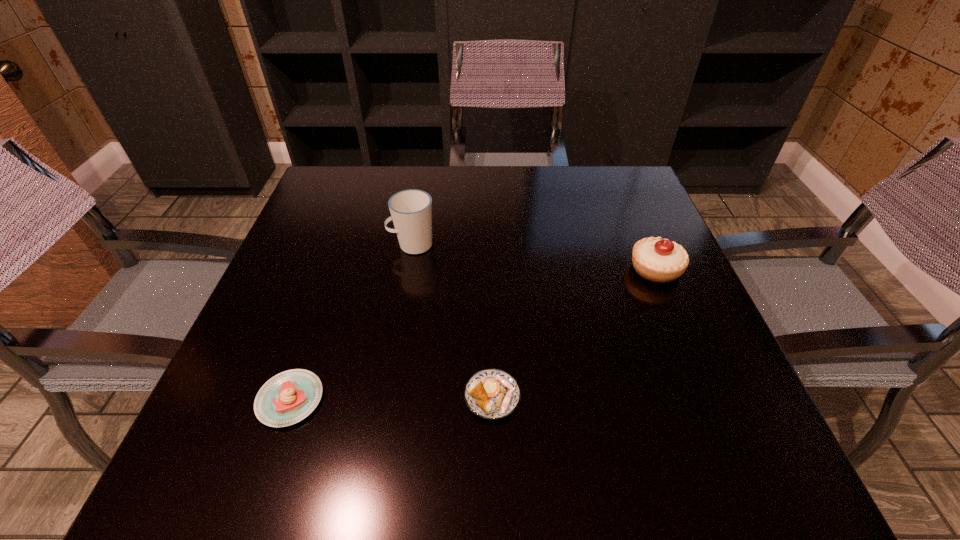
This screenshot has height=540, width=960. I want to click on object that can be found as the closest to the rightmost object, so click(x=492, y=393).

Identify which object is the third closest to the second pastry from left to right. Please provide its 2D coordinates. Your answer should be formatted as a tuple, i.e. [(x, y)], where the tuple contains the x and y coordinates of a point satisfying the conditions above.

[(660, 260)]

Identify which pastry is the second closest to the leftmost pastry. Please provide its 2D coordinates. Your answer should be formatted as a tuple, i.e. [(x, y)], where the tuple contains the x and y coordinates of a point satisfying the conditions above.

[(660, 260)]

Select which pastry appears as the second closest to the tallest pastry. Please provide its 2D coordinates. Your answer should be formatted as a tuple, i.e. [(x, y)], where the tuple contains the x and y coordinates of a point satisfying the conditions above.

[(287, 398)]

The height and width of the screenshot is (540, 960). I want to click on free location that satisfies the following two spatial constraints: 1. with a handle on the side of the tallest object; 2. on the back side of the rightmost object, so coord(408,269).

Locate an element on the screen. vacant space that satisfies the following two spatial constraints: 1. with a handle on the side of the second object from left to right; 2. on the back side of the second tallest object is located at coordinates (408, 269).

You are a GUI agent. You are given a task and a screenshot of the screen. Output one action in this format:
    pyautogui.click(x=<x>, y=<y>)
    Task: Click on the free point that satisfies the following two spatial constraints: 1. with a handle on the side of the second tallest object; 2. on the right side of the cup
    This screenshot has height=540, width=960.
    Given the screenshot: What is the action you would take?
    pyautogui.click(x=408, y=269)

Locate an element on the screen. This screenshot has height=540, width=960. vacant region that satisfies the following two spatial constraints: 1. with a handle on the side of the second object from right to left; 2. on the right side of the cup is located at coordinates (386, 396).

The width and height of the screenshot is (960, 540). In order to click on free point that satisfies the following two spatial constraints: 1. with a handle on the side of the tallest pastry; 2. on the right side of the tallest object in this screenshot , I will do `click(408, 269)`.

Find the location of a particular element. Image resolution: width=960 pixels, height=540 pixels. vacant point that satisfies the following two spatial constraints: 1. with a handle on the side of the third object from right to left; 2. on the left side of the farthest pastry is located at coordinates (408, 269).